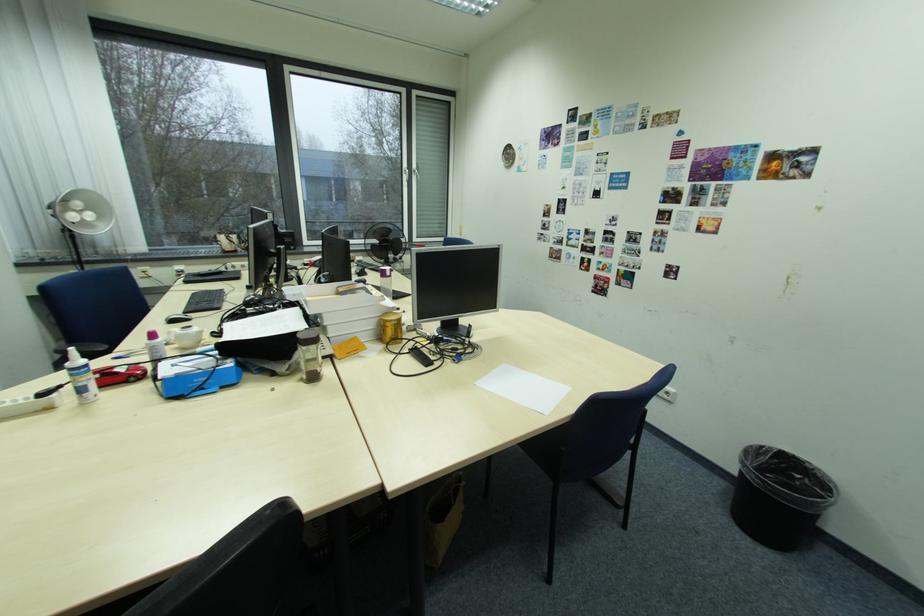
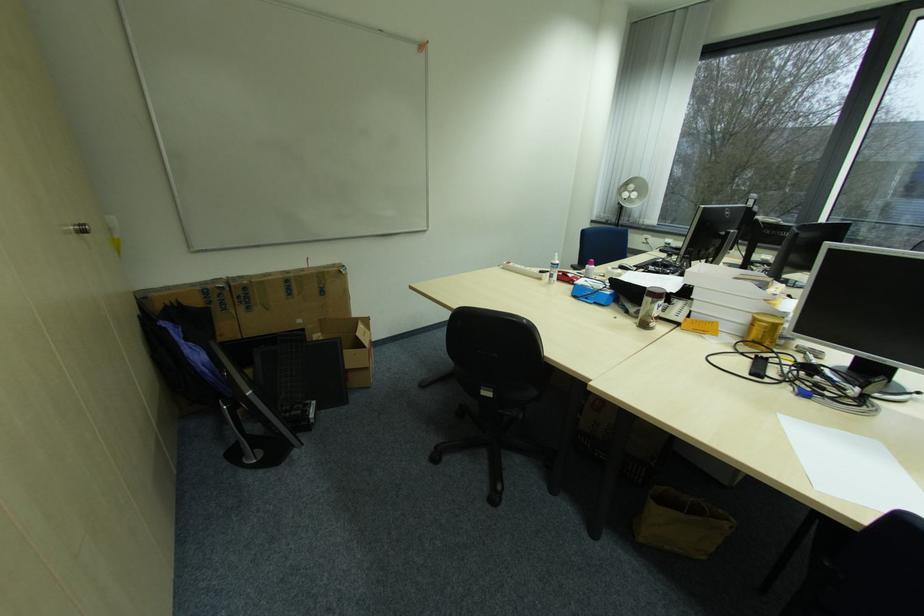
Locate, in the second image, the point that corresponds to point 69,387 in the first image.

(555, 273)